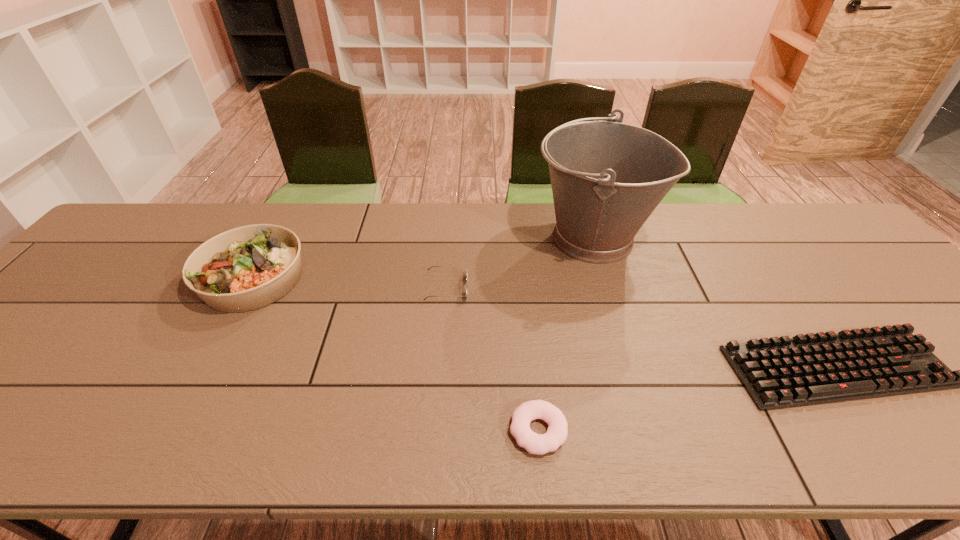
You are a GUI agent. You are given a task and a screenshot of the screen. Output one action in this format:
    pyautogui.click(x=<x>, y=<y>)
    Task: Click on the bucket that is at the far edge
    This screenshot has height=540, width=960.
    Given the screenshot: What is the action you would take?
    pyautogui.click(x=607, y=177)

The image size is (960, 540). Find the location of `salad plate located at the far edge`. salad plate located at the far edge is located at coordinates (249, 267).

This screenshot has height=540, width=960. In order to click on object positioned at the near edge in this screenshot , I will do `click(557, 432)`.

Find the location of a particular element. vacant space at the far edge of the desktop is located at coordinates (789, 238).

In the image, there is a desktop. Identify the location of vacant space at the near edge. This screenshot has width=960, height=540. (321, 420).

Identify the location of vacant space at the right edge of the desktop. The height and width of the screenshot is (540, 960). [914, 324].

The width and height of the screenshot is (960, 540). What are the coordinates of `free location at the far right corner` in the screenshot? It's located at (804, 233).

In order to click on vacant space in between the bucket and the fourth shortest object in this screenshot , I will do `click(423, 258)`.

At what (x,y) coordinates should I click in order to perform the action: click on free spot between the doughnut and the sunglasses. Please return your answer as a coordinate pair (x, y). Looking at the image, I should click on (492, 359).

Find the location of a particular element. empty location between the second tallest object and the doughnut is located at coordinates (396, 354).